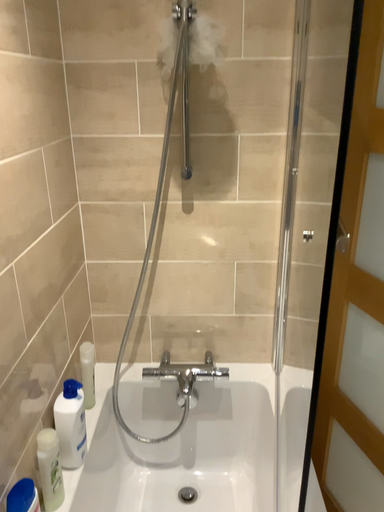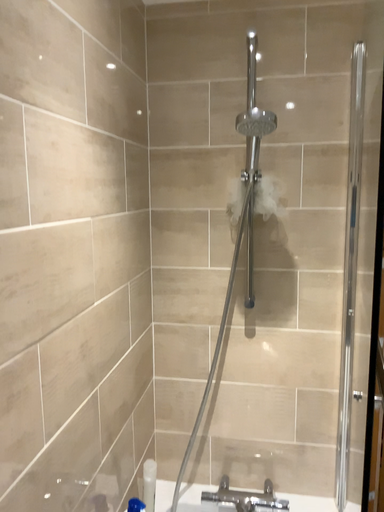
Question: How did the camera likely rotate when shooting the video?

Choices:
 (A) rotated downward
 (B) rotated upward

Answer: (B)